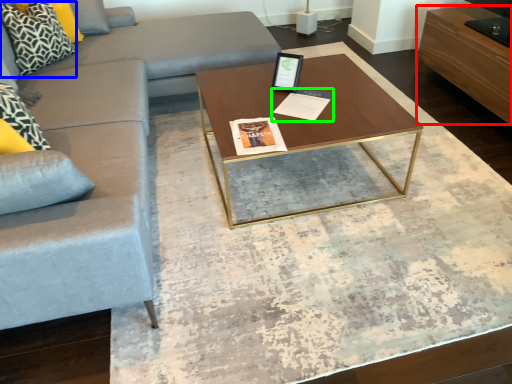
Question: Which object is the farthest from drawer (highlighted by a red box)? Choose among these: pillow (highlighted by a blue box) or magazine (highlighted by a green box).

Choices:
 (A) pillow
 (B) magazine

Answer: (A)